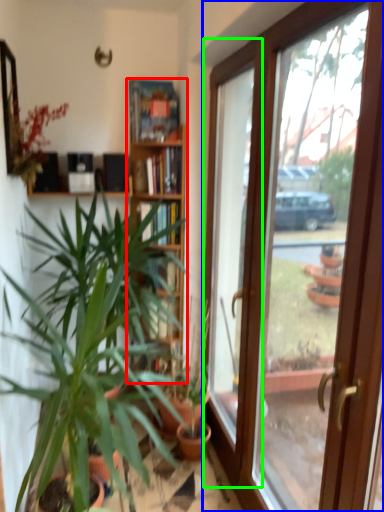
Question: Estimate the real-world distances between objects in this image. Which object is farther from bookcase (highlighted by a red box), door (highlighted by a blue box) or window (highlighted by a green box)?

Choices:
 (A) door
 (B) window

Answer: (A)